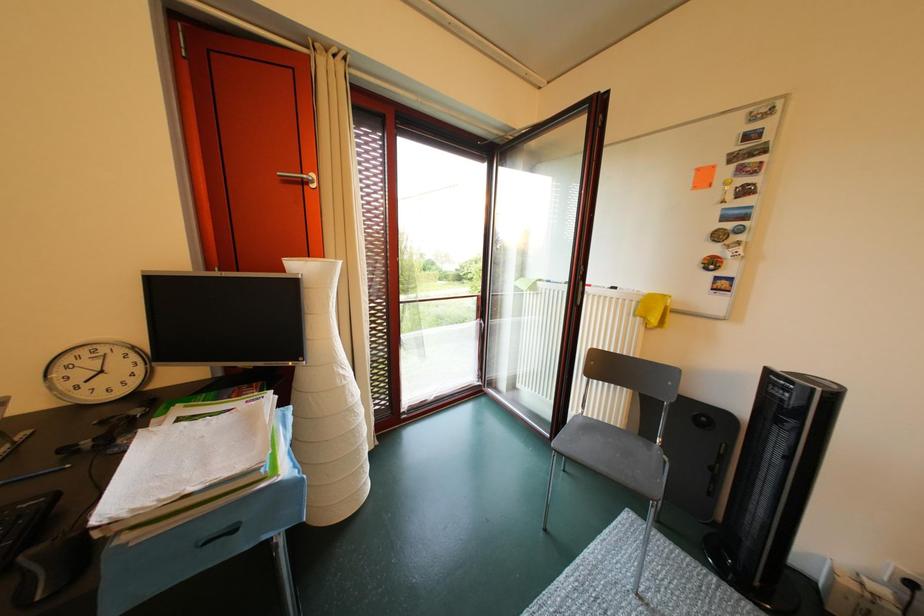
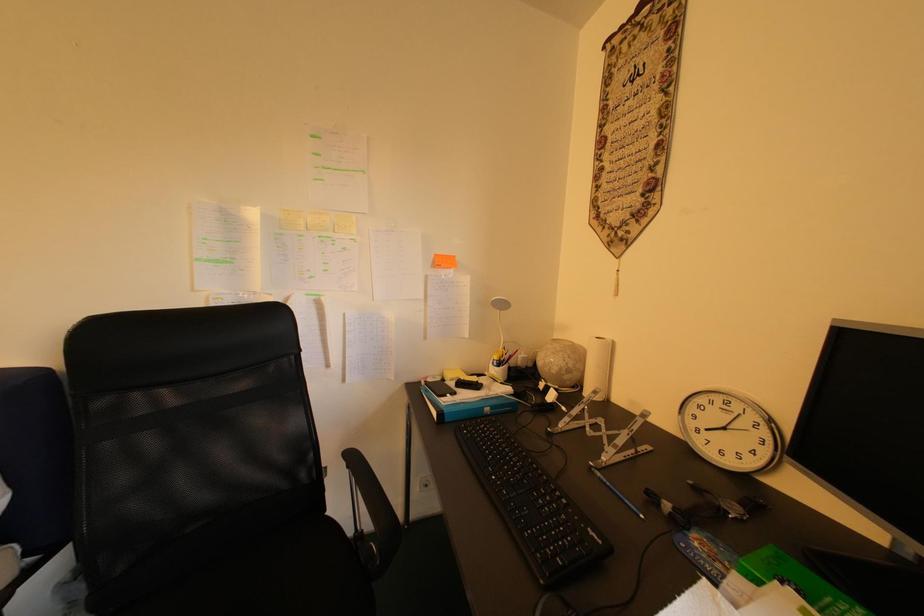
Question: Based on the continuous images, in which direction is the camera rotating? Reply with the corresponding letter.

Choices:
 (A) Left
 (B) Right
 (C) Up
 (D) Down

Answer: (A)